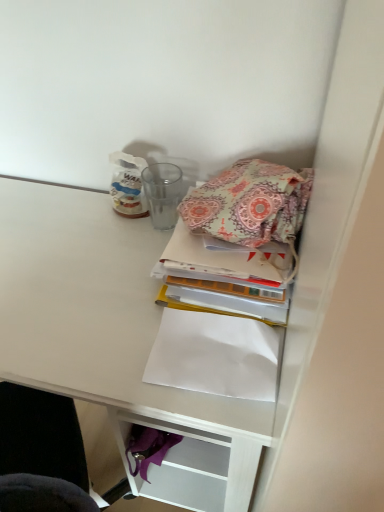
Locate an element on the screen. The width and height of the screenshot is (384, 512). vacant space situated above white matte desk at upper right (from a real-world perspective) is located at coordinates (96, 275).